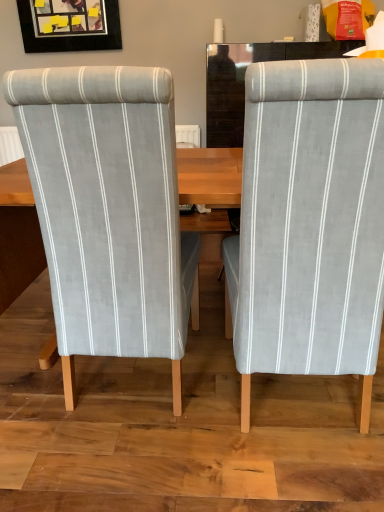
Question: Does light gray fabric chair at right, acting as the 1th chair starting from the right, turn towards matte black picture frame at upper left?

Choices:
 (A) no
 (B) yes

Answer: (A)

Question: From the image's perspective, is light gray fabric chair at right, which is the second chair in left-to-right order, located above matte black picture frame at upper left?

Choices:
 (A) yes
 (B) no

Answer: (B)

Question: Is light gray fabric chair at right, acting as the 1th chair starting from the right, with matte black picture frame at upper left?

Choices:
 (A) no
 (B) yes

Answer: (A)

Question: Is light gray fabric chair at right, acting as the 1th chair starting from the right, bigger than matte black picture frame at upper left?

Choices:
 (A) no
 (B) yes

Answer: (B)

Question: From a real-world perspective, is light gray fabric chair at right, which is the second chair in left-to-right order, beneath matte black picture frame at upper left?

Choices:
 (A) no
 (B) yes

Answer: (B)

Question: Is light gray fabric chair at right, which is the second chair in left-to-right order, outside matte black picture frame at upper left?

Choices:
 (A) no
 (B) yes

Answer: (B)

Question: Is light gray fabric chair at right, acting as the 1th chair starting from the right, bigger than light gray fabric chair at left, the first chair in the left-to-right sequence?

Choices:
 (A) yes
 (B) no

Answer: (B)

Question: Does light gray fabric chair at right, acting as the 1th chair starting from the right, turn towards light gray fabric chair at left, the first chair in the left-to-right sequence?

Choices:
 (A) yes
 (B) no

Answer: (B)

Question: Does light gray fabric chair at right, which is the second chair in left-to-right order, have a greater width compared to light gray fabric chair at left, the first chair in the left-to-right sequence?

Choices:
 (A) yes
 (B) no

Answer: (A)

Question: Is light gray fabric chair at right, acting as the 1th chair starting from the right, to the right of light gray fabric chair at left, the 2th chair positioned from the right, from the viewer's perspective?

Choices:
 (A) no
 (B) yes

Answer: (B)

Question: Is light gray fabric chair at right, which is the second chair in left-to-right order, at the left side of light gray fabric chair at left, the first chair in the left-to-right sequence?

Choices:
 (A) yes
 (B) no

Answer: (B)

Question: Is light gray fabric chair at right, which is the second chair in left-to-right order, placed right next to light gray fabric chair at left, the first chair in the left-to-right sequence?

Choices:
 (A) no
 (B) yes

Answer: (A)

Question: From the image's perspective, is light gray fabric chair at left, the first chair in the left-to-right sequence, located above matte black picture frame at upper left?

Choices:
 (A) yes
 (B) no

Answer: (B)